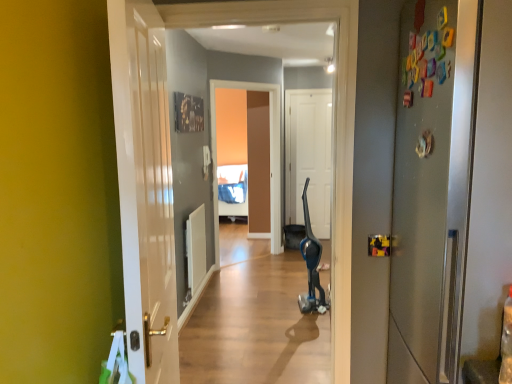
Question: Is satin silver refrigerator at right, which ranks as the first door in right-to-left order, taller than white matte door at center, positioned as the 3th door in front-to-back order?

Choices:
 (A) yes
 (B) no

Answer: (B)

Question: Is satin silver refrigerator at right, which ranks as the first door in front-to-back order, wider than white matte door at center, which ranks as the 1th door in back-to-front order?

Choices:
 (A) yes
 (B) no

Answer: (A)

Question: From the image's perspective, would you say satin silver refrigerator at right, which is counted as the 3th door, starting from the back, is shown under white matte door at center, which ranks as the 1th door in back-to-front order?

Choices:
 (A) yes
 (B) no

Answer: (A)

Question: From the image's perspective, is satin silver refrigerator at right, which is counted as the 3th door, starting from the back, located above white matte door at center, the 2th door when ordered from left to right?

Choices:
 (A) no
 (B) yes

Answer: (A)

Question: Can you confirm if satin silver refrigerator at right, which ranks as the first door in right-to-left order, is bigger than white matte door at center, positioned as the 3th door in front-to-back order?

Choices:
 (A) yes
 (B) no

Answer: (A)

Question: Considering the positions of satin silver refrigerator at right, which ranks as the first door in right-to-left order, and matte brown screen door at center in the image, is satin silver refrigerator at right, which ranks as the first door in right-to-left order, bigger or smaller than matte brown screen door at center?

Choices:
 (A) small
 (B) big

Answer: (B)

Question: Is satin silver refrigerator at right, which ranks as the first door in front-to-back order, situated inside matte brown screen door at center or outside?

Choices:
 (A) outside
 (B) inside

Answer: (A)

Question: Looking at their shapes, would you say satin silver refrigerator at right, which ranks as the first door in front-to-back order, is wider or thinner than matte brown screen door at center?

Choices:
 (A) wide
 (B) thin

Answer: (A)

Question: Based on their positions, is satin silver refrigerator at right, which ranks as the first door in right-to-left order, located to the left or right of matte brown screen door at center?

Choices:
 (A) left
 (B) right

Answer: (B)

Question: From a real-world perspective, relative to blue metallic vacuum cleaner at center, is matte brown screen door at center vertically above or below?

Choices:
 (A) below
 (B) above

Answer: (B)

Question: Looking at their shapes, would you say matte brown screen door at center is wider or thinner than blue metallic vacuum cleaner at center?

Choices:
 (A) thin
 (B) wide

Answer: (A)

Question: In terms of height, does matte brown screen door at center look taller or shorter compared to blue metallic vacuum cleaner at center?

Choices:
 (A) tall
 (B) short

Answer: (A)

Question: Relative to blue metallic vacuum cleaner at center, is matte brown screen door at center in front or behind?

Choices:
 (A) behind
 (B) front

Answer: (A)

Question: From a real-world perspective, relative to satin silver refrigerator at right, which ranks as the first door in front-to-back order, is white glossy door at left, the first door positioned from the left, vertically above or below?

Choices:
 (A) above
 (B) below

Answer: (B)

Question: Considering the relative positions of white glossy door at left, the 2th door viewed from the front, and satin silver refrigerator at right, which is counted as the 3th door, starting from the back, in the image provided, is white glossy door at left, the 2th door viewed from the front, to the left or to the right of satin silver refrigerator at right, which is counted as the 3th door, starting from the back,?

Choices:
 (A) left
 (B) right

Answer: (A)